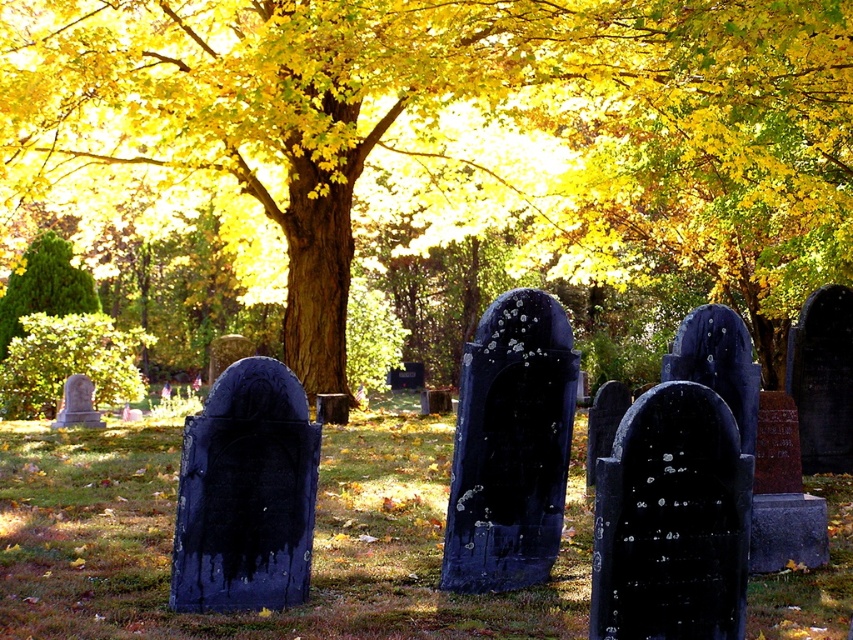
Is point (701, 10) positioned in front of point (15, 333)?

Yes, it is in front of point (15, 333).

Based on the photo, who is lower down, golden textured tree at center or green textured bush at left?

green textured bush at left is below.

Is point (636, 208) behind point (91, 280)?

That is True.

The height and width of the screenshot is (640, 853). I want to click on golden textured tree at center, so click(x=473, y=104).

Between green textured bush at left and smooth gray stone at lower left, which one is positioned lower?

Positioned lower is smooth gray stone at lower left.

Who is more distant from viewer, (33,298) or (74,424)?

The point (33,298) is behind.

Does point (0, 308) lie behind point (86, 387)?

Yes, point (0, 308) is behind point (86, 387).

Where is `green textured bush at left`? green textured bush at left is located at coordinates (44, 288).

Which is above, golden textured tree at center or smooth gray stone at lower left?

golden textured tree at center is higher up.

This screenshot has height=640, width=853. What do you see at coordinates (473, 104) in the screenshot? I see `golden textured tree at center` at bounding box center [473, 104].

Identify the location of golden textured tree at center. (473, 104).